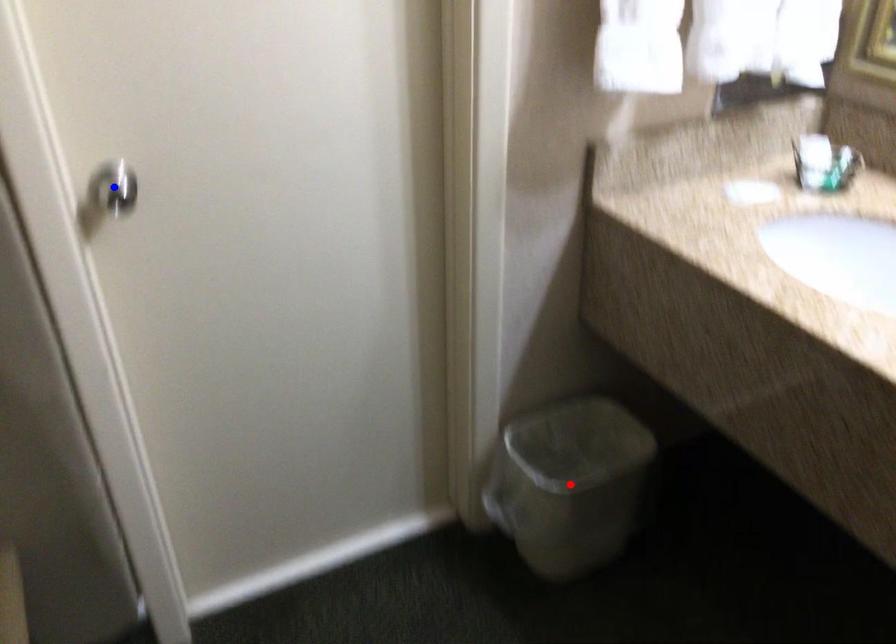
Question: Which of the two points in the image is closer to the camera?

Choices:
 (A) Blue point is closer.
 (B) Red point is closer.

Answer: (A)